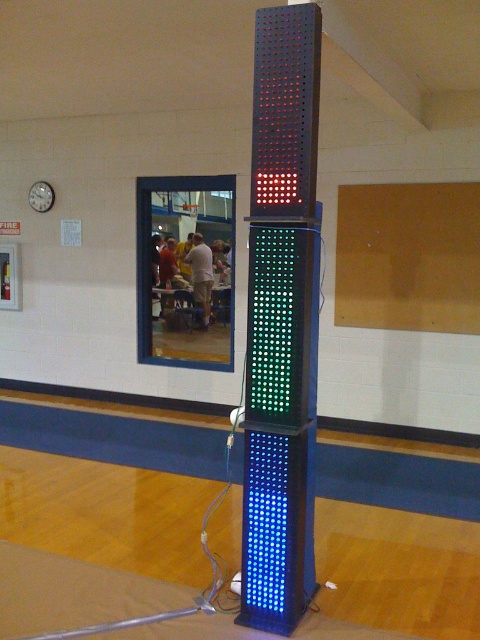
Question: Which point is closer to the camera?

Choices:
 (A) metallic wall clock at upper left
 (B) multicolored led display at center

Answer: (B)

Question: Can you confirm if multicolored led display at center is positioned above metallic wall clock at upper left?

Choices:
 (A) no
 (B) yes

Answer: (A)

Question: Which object appears closest to the camera in this image?

Choices:
 (A) multicolored led display at center
 (B) metallic wall clock at upper left

Answer: (A)

Question: Does multicolored led display at center appear on the right side of metallic wall clock at upper left?

Choices:
 (A) yes
 (B) no

Answer: (A)

Question: Is multicolored led display at center smaller than metallic wall clock at upper left?

Choices:
 (A) yes
 (B) no

Answer: (B)